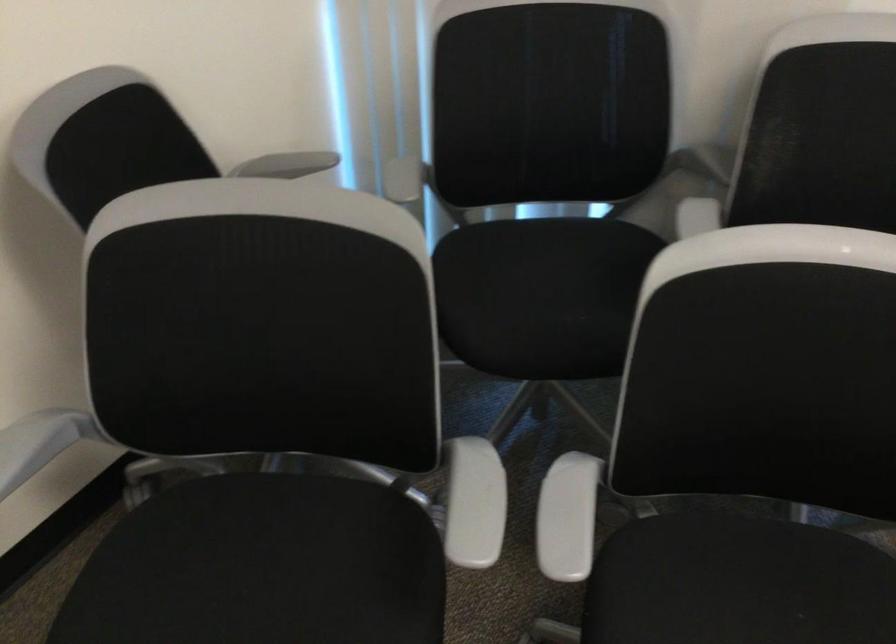
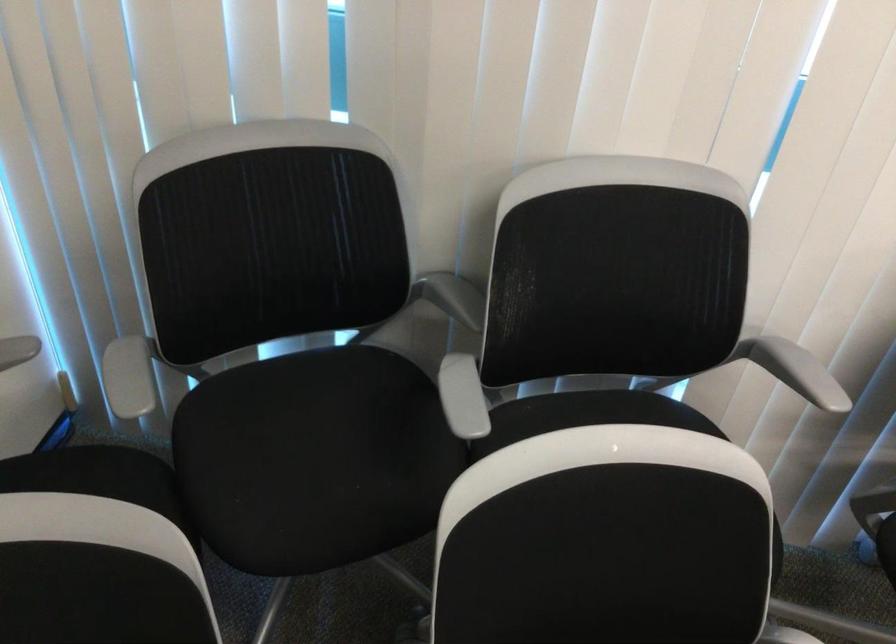
Where in the second image is the point corresponding to point (707, 156) from the first image?

(453, 297)